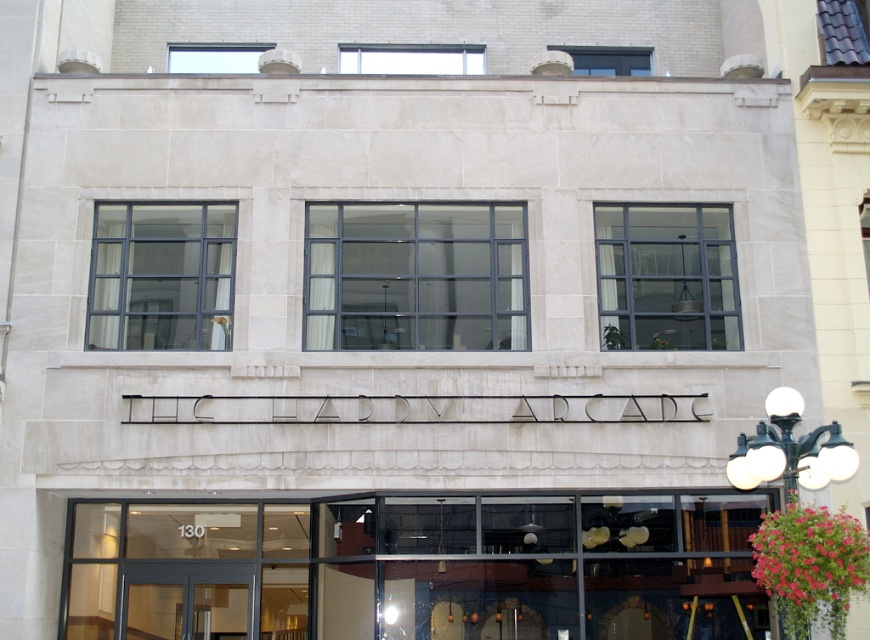
Which is more to the left, clear glass door at lower center or black metal streetlamp at upper right?

clear glass door at lower center is more to the left.

Is clear glass door at lower center smaller than black metal streetlamp at upper right?

No.

Who is more forward, (146,614) or (760,456)?

Point (760,456) is in front.

The image size is (870, 640). Identify the location of clear glass door at lower center. (186, 600).

Looking at this image, is clear glass doors at lower center bigger than clear glass door at lower center?

Correct, clear glass doors at lower center is larger in size than clear glass door at lower center.

Who is taller, clear glass doors at lower center or clear glass door at lower center?

clear glass doors at lower center

Does point (671, 545) lie behind point (219, 588)?

No, (671, 545) is closer to viewer.

You are a GUI agent. You are given a task and a screenshot of the screen. Output one action in this format:
    pyautogui.click(x=<x>, y=<y>)
    Task: Click on the clear glass doors at lower center
    
    Given the screenshot: What is the action you would take?
    pyautogui.click(x=418, y=568)

Does clear glass doors at lower center appear over black metal streetlamp at upper right?

No.

Between point (402, 612) and point (734, 452), which one is positioned behind?

Positioned behind is point (402, 612).

Which is in front, point (348, 579) or point (780, 445)?

Point (780, 445) is more forward.

I want to click on clear glass doors at lower center, so click(x=418, y=568).